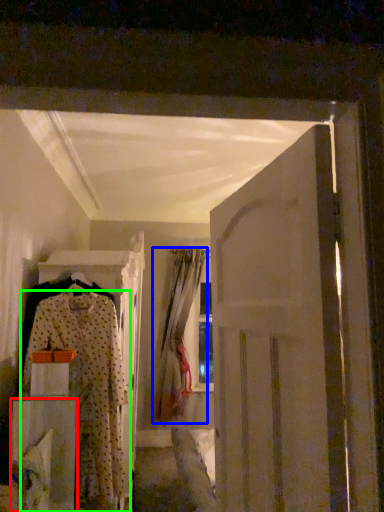
Question: Considering the real-world distances, which object is closest to furniture (highlighted by a red box)? curtain (highlighted by a blue box) or fancy dress (highlighted by a green box).

Choices:
 (A) curtain
 (B) fancy dress

Answer: (B)